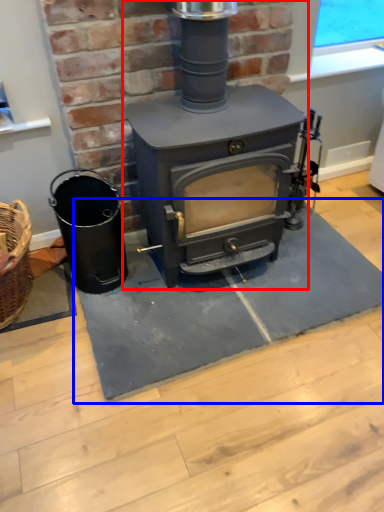
Question: Which of the following is the closest to the observer, wood burning stove (highlighted by a red box) or doormat (highlighted by a blue box)?

Choices:
 (A) wood burning stove
 (B) doormat

Answer: (A)